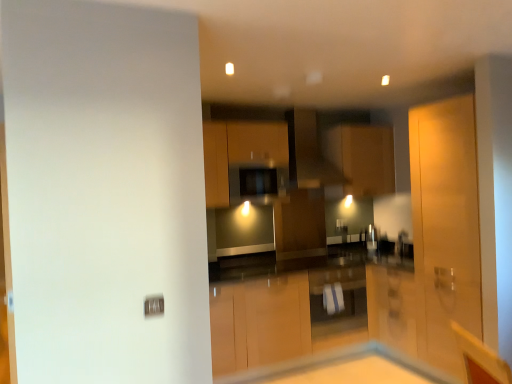
What do you see at coordinates (445, 227) in the screenshot?
I see `matte wood screen door at right` at bounding box center [445, 227].

Measure the distance between matte wood cabinet at center, the 3th cabinetry from the right, and camera.

A distance of 3.57 meters exists between matte wood cabinet at center, the 3th cabinetry from the right, and camera.

What is the approximate width of white glossy cabinet at center, acting as the second cabinetry starting from the right?

white glossy cabinet at center, acting as the second cabinetry starting from the right, is 19.78 inches wide.

The height and width of the screenshot is (384, 512). I want to click on white glossy cabinet at center, arranged as the 3th cabinetry when viewed from the top, so click(x=341, y=311).

Find the location of `matte wood cabinet at center, the 3th cabinetry in the left-to-right sequence`. matte wood cabinet at center, the 3th cabinetry in the left-to-right sequence is located at coordinates (361, 158).

I want to click on matte black exhaust hood at center, so click(x=308, y=153).

Is matte black exhaust hood at center placed right next to matte wood screen door at right?

matte black exhaust hood at center is not next to matte wood screen door at right, and they're not touching.

Which is in front, point (304, 133) or point (436, 120)?

The point (436, 120) is more forward.

You are a GUI agent. You are given a task and a screenshot of the screen. Output one action in this format:
    pyautogui.click(x=<x>, y=<y>)
    Task: Click on the screen door in front of the matte black exhaust hood at center
    The width and height of the screenshot is (512, 384).
    Given the screenshot: What is the action you would take?
    pyautogui.click(x=445, y=227)

Consider the image. Does matte black exhaust hood at center have a lesser height compared to matte wood screen door at right?

Yes.

Find the location of a particular element. This screenshot has height=384, width=512. table located in front of the matte wood cabinet at center, arranged as the 2th cabinetry when ordered from the bottom is located at coordinates (345, 369).

From a real-world perspective, between white glossy table at center and matte wood cabinet at center, which appears as the 2th cabinetry when viewed from the top, who is vertically lower?

white glossy table at center, from a real-world perspective.

Considering their positions, is white glossy table at center located in front of or behind matte wood cabinet at center, the 3th cabinetry from the right?

Clearly, white glossy table at center is in front of matte wood cabinet at center, the 3th cabinetry from the right.

Could you tell me if white glossy table at center is facing matte wood cabinet at center, arranged as the 2th cabinetry when ordered from the bottom?

No, white glossy table at center is not aimed at matte wood cabinet at center, arranged as the 2th cabinetry when ordered from the bottom.

Is matte wood cabinet at center, which is counted as the third cabinetry, starting from the bottom, located outside matte wood cabinet at center, arranged as the 2th cabinetry when ordered from the bottom?

Yes, matte wood cabinet at center, which is counted as the third cabinetry, starting from the bottom, is not within matte wood cabinet at center, arranged as the 2th cabinetry when ordered from the bottom.

Can you confirm if matte wood cabinet at center, the 3th cabinetry in the left-to-right sequence, is thinner than matte wood cabinet at center, the 3th cabinetry from the right?

In fact, matte wood cabinet at center, the 3th cabinetry in the left-to-right sequence, might be wider than matte wood cabinet at center, the 3th cabinetry from the right.

Considering the sizes of objects matte wood cabinet at center, which is counted as the third cabinetry, starting from the bottom, and matte wood cabinet at center, which appears as the 2th cabinetry when viewed from the top, in the image provided, who is shorter, matte wood cabinet at center, which is counted as the third cabinetry, starting from the bottom, or matte wood cabinet at center, which appears as the 2th cabinetry when viewed from the top,?

matte wood cabinet at center, which appears as the 2th cabinetry when viewed from the top, is shorter.

Does matte wood cabinet at center, which is counted as the third cabinetry, starting from the bottom, touch matte wood cabinet at center, arranged as the 2th cabinetry when ordered from the bottom?

matte wood cabinet at center, which is counted as the third cabinetry, starting from the bottom, and matte wood cabinet at center, arranged as the 2th cabinetry when ordered from the bottom, are not in contact.

In terms of size, does matte black exhaust hood at center appear bigger or smaller than matte wood cabinet at center, arranged as the first cabinetry when viewed from the right?

Clearly, matte black exhaust hood at center is larger in size than matte wood cabinet at center, arranged as the first cabinetry when viewed from the right.

Is matte black exhaust hood at center next to matte wood cabinet at center, which is counted as the third cabinetry, starting from the bottom?

No, matte black exhaust hood at center is not beside matte wood cabinet at center, which is counted as the third cabinetry, starting from the bottom.

Is matte black exhaust hood at center looking in the opposite direction of matte wood cabinet at center, the 3th cabinetry in the left-to-right sequence?

That's not correct — matte black exhaust hood at center is not looking away from matte wood cabinet at center, the 3th cabinetry in the left-to-right sequence.

Which is in front, matte black exhaust hood at center or matte wood cabinet at center, the first cabinetry viewed from the top?

Positioned in front is matte black exhaust hood at center.

Locate an element on the screen. The height and width of the screenshot is (384, 512). the 1st cabinetry counting from the right of the matte black exhaust hood at center is located at coordinates (341, 311).

From a real-world perspective, relative to white glossy cabinet at center, acting as the second cabinetry starting from the right, is matte black exhaust hood at center vertically above or below?

Clearly, from a real-world perspective, matte black exhaust hood at center is above white glossy cabinet at center, acting as the second cabinetry starting from the right.

Considering the sizes of objects matte black exhaust hood at center and white glossy cabinet at center, acting as the second cabinetry starting from the right, in the image provided, who is shorter, matte black exhaust hood at center or white glossy cabinet at center, acting as the second cabinetry starting from the right,?

white glossy cabinet at center, acting as the second cabinetry starting from the right.

Does matte black exhaust hood at center come in front of white glossy cabinet at center, arranged as the 3th cabinetry when viewed from the top?

No, matte black exhaust hood at center is further to the viewer.

Between matte wood screen door at right and white glossy table at center, which one has larger width?

Wider between the two is white glossy table at center.

Is matte wood screen door at right looking in the opposite direction of white glossy table at center?

That's not correct — matte wood screen door at right is not looking away from white glossy table at center.

Between matte wood screen door at right and white glossy table at center, which one appears on the left side from the viewer's perspective?

Positioned to the left is white glossy table at center.

From a real-world perspective, is matte wood screen door at right located higher than white glossy table at center?

Correct, in the physical world, matte wood screen door at right is higher than white glossy table at center.

Considering the sizes of matte wood screen door at right and matte wood cabinet at center, the first cabinetry viewed from the top, in the image, is matte wood screen door at right taller or shorter than matte wood cabinet at center, the first cabinetry viewed from the top,?

Considering their sizes, matte wood screen door at right has more height than matte wood cabinet at center, the first cabinetry viewed from the top.

How different are the orientations of matte wood screen door at right and matte wood cabinet at center, arranged as the first cabinetry when viewed from the right, in degrees?

90.2 degrees.

Visually, is matte wood screen door at right positioned to the left or to the right of matte wood cabinet at center, arranged as the first cabinetry when viewed from the right?

matte wood screen door at right is positioned on matte wood cabinet at center, arranged as the first cabinetry when viewed from the right,'s right side.

Starting from the matte wood screen door at right, which cabinetry is the 1st one to the left? Please provide its 2D coordinates.

[(361, 158)]

Image resolution: width=512 pixels, height=384 pixels. Find the location of `screen door beneath the matte black exhaust hood at center (from a real-world perspective)`. screen door beneath the matte black exhaust hood at center (from a real-world perspective) is located at coordinates (445, 227).

This screenshot has height=384, width=512. In order to click on the 1st cabinetry behind the white glossy table at center in this screenshot , I will do `click(240, 153)`.

Which object lies nearer to the anchor point matte wood cabinet at center, the 3th cabinetry in the left-to-right sequence, matte black exhaust hood at center or white glossy table at center?

Among the two, matte black exhaust hood at center is located nearer to matte wood cabinet at center, the 3th cabinetry in the left-to-right sequence.

Looking at this image, considering their positions, is matte black exhaust hood at center positioned closer to matte wood screen door at right than white glossy table at center?

Based on the image, white glossy table at center appears to be nearer to matte wood screen door at right.

Which object lies nearer to the anchor point white glossy table at center, white glossy cabinet at center, arranged as the 3th cabinetry when viewed from the top, or matte wood cabinet at center, the 3th cabinetry in the left-to-right sequence?

white glossy cabinet at center, arranged as the 3th cabinetry when viewed from the top, is positioned closer to the anchor white glossy table at center.

Which object lies further to the anchor point matte wood cabinet at center, which is counted as the third cabinetry, starting from the bottom, white glossy table at center or matte black exhaust hood at center?

white glossy table at center lies further to matte wood cabinet at center, which is counted as the third cabinetry, starting from the bottom, than the other object.

From the image, which object appears to be farther from matte wood cabinet at center, the first cabinetry viewed from the top, white glossy table at center or matte wood screen door at right?

The object further to matte wood cabinet at center, the first cabinetry viewed from the top, is white glossy table at center.

Which object lies nearer to the anchor point matte wood cabinet at center, the 1th cabinetry positioned from the left, white glossy table at center or matte wood screen door at right?

The object closer to matte wood cabinet at center, the 1th cabinetry positioned from the left, is matte wood screen door at right.

Looking at the image, which one is located further to matte wood cabinet at center, which is counted as the third cabinetry, starting from the bottom, white glossy table at center or matte wood cabinet at center, the 3th cabinetry from the right?

Based on the image, white glossy table at center appears to be further to matte wood cabinet at center, which is counted as the third cabinetry, starting from the bottom.

Looking at this image, considering their positions, is matte wood cabinet at center, the 3th cabinetry in the left-to-right sequence, positioned further to matte wood screen door at right than matte black exhaust hood at center?

matte black exhaust hood at center.

Identify the location of screen door between matte black exhaust hood at center and white glossy cabinet at center, acting as the second cabinetry starting from the right, vertically. (445, 227).

Locate an element on the screen. screen door that lies between matte wood cabinet at center, the first cabinetry viewed from the top, and white glossy cabinet at center, acting as the second cabinetry starting from the right, from top to bottom is located at coordinates (445, 227).

Locate an element on the screen. cabinetry between matte wood cabinet at center, the 3th cabinetry from the right, and white glossy table at center, in the vertical direction is located at coordinates (341, 311).

You are a GUI agent. You are given a task and a screenshot of the screen. Output one action in this format:
    pyautogui.click(x=<x>, y=<y>)
    Task: Click on the cabinetry between matte wood cabinet at center, the first cabinetry viewed from the top, and white glossy cabinet at center, acting as the second cabinetry starting from the right, in the up-down direction
    
    Given the screenshot: What is the action you would take?
    pyautogui.click(x=240, y=153)